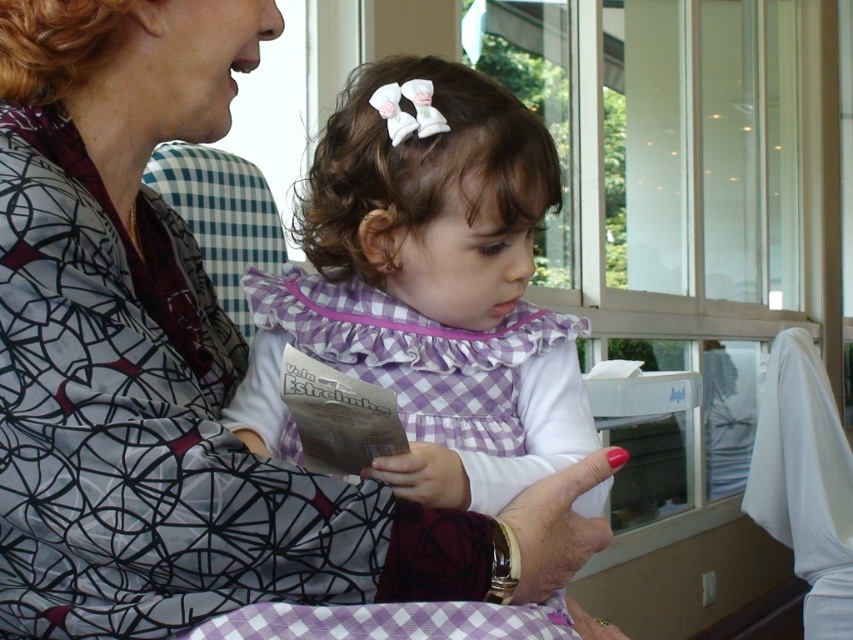
Question: Is matte black blouse at center further to the viewer compared to purple checkered dress at center?

Choices:
 (A) no
 (B) yes

Answer: (A)

Question: Which point is farther from the camera taking this photo?

Choices:
 (A) (39, 397)
 (B) (425, 323)

Answer: (B)

Question: Which point is closer to the camera?

Choices:
 (A) (358, 272)
 (B) (296, 536)

Answer: (B)

Question: Can you confirm if matte black blouse at center is positioned above purple checkered dress at center?

Choices:
 (A) no
 (B) yes

Answer: (A)

Question: Which object appears farthest from the camera in this image?

Choices:
 (A) matte black blouse at center
 (B) purple checkered dress at center

Answer: (B)

Question: Can you confirm if matte black blouse at center is positioned to the right of purple checkered dress at center?

Choices:
 (A) yes
 (B) no

Answer: (B)